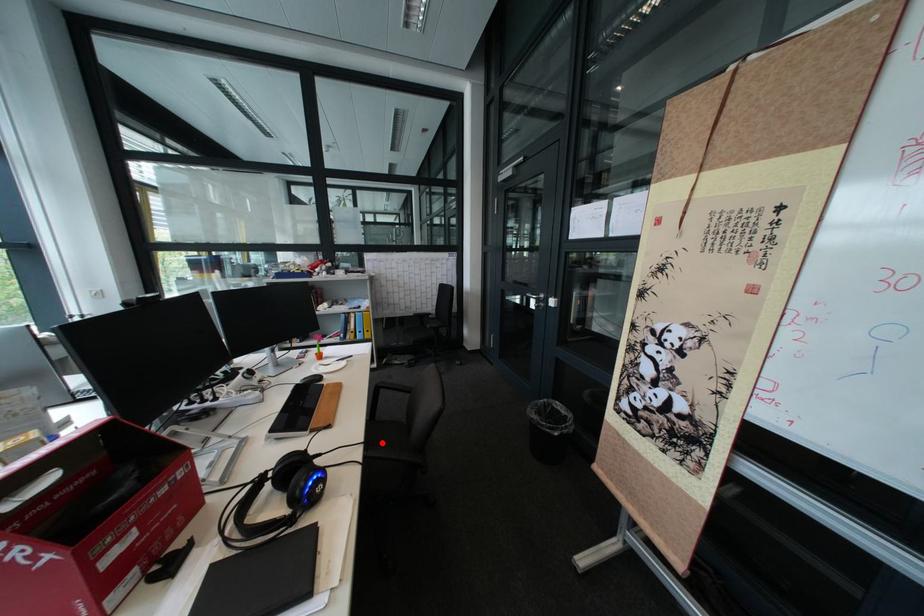
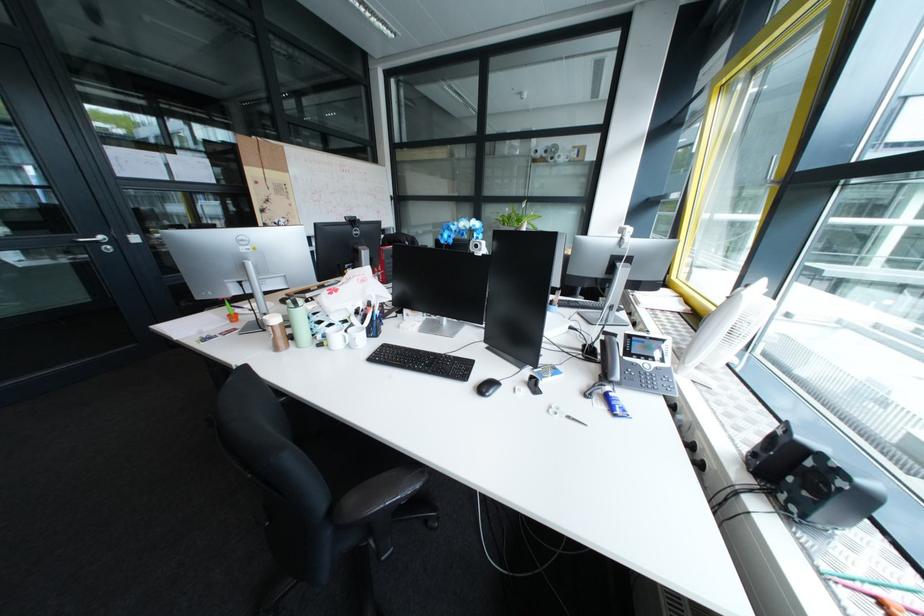
Question: I am providing you with two images of the same scene from different viewpoints. A red point is marked on the first image. Is the red point's position out of view in image 2?

Choices:
 (A) Yes
 (B) No

Answer: (A)